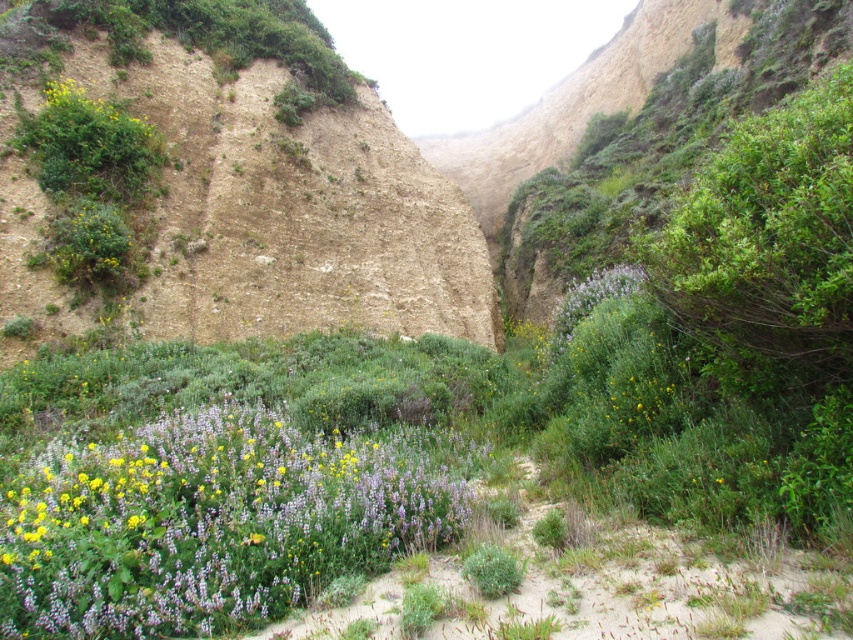
You are a botanist examining the canyon landscape. You notice the purple matte flowers at center and the yellow matte flower at upper left. Which flower is shorter?

The purple matte flowers at center is shorter than the yellow matte flower at upper left.

You are a botanist examining the canyon. You notice the purple matte flowers at center and the yellow matte flower at upper left. Which one has a larger size?

The purple matte flowers at center is bigger than the yellow matte flower at upper left.

You are an artist painting this scene and want to place a small bee between the purple matte flowers at center and the yellow matte flower at upper left. Based on their positions, which flower should the bee be closer to?

The purple matte flowers at center are to the right of the yellow matte flower at upper left, so the bee should be closer to the yellow matte flower at upper left since it is positioned to the left.